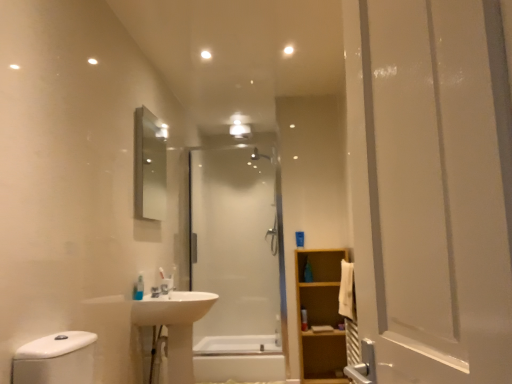
Question: In the image, is white glossy sink at center positioned in front of or behind white glossy bathtub at center?

Choices:
 (A) behind
 (B) front

Answer: (B)

Question: Which is correct: white glossy sink at center is inside white glossy bathtub at center, or outside of it?

Choices:
 (A) outside
 (B) inside

Answer: (A)

Question: Estimate the real-world distances between objects in this image. Which object is farther from the silver metallic mirror at upper left?

Choices:
 (A) translucent plastic soap dispenser at lower left, placed as the second toiletry when sorted from bottom to top
 (B) light brown wooden cabinet at right
 (C) transparent glass shower at center
 (D) white glossy sink at center
 (E) white glossy bathtub at center

Answer: (C)

Question: Which of these objects is positioned farthest from the silver metallic mirror at upper left?

Choices:
 (A) white glossy sink at center
 (B) white glossy bathtub at center
 (C) transparent glass shower at center
 (D) translucent plastic bottle at center, the 1th toiletry positioned from the back
 (E) translucent plastic soap dispenser at lower left, positioned as the first toiletry in top-to-bottom order

Answer: (D)